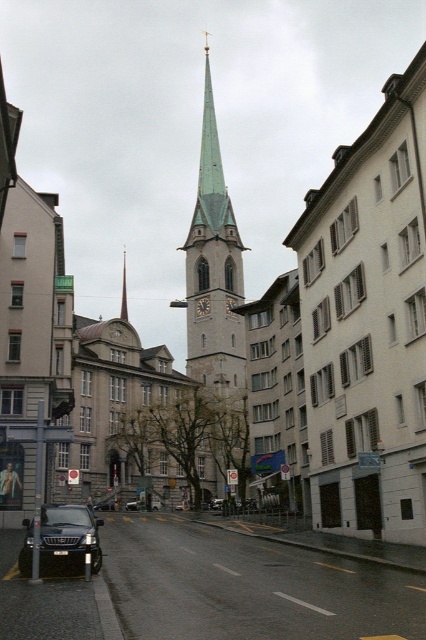
You are a pedestrian standing at the intersection and want to cross the street to reach the church tower in the background. You see a shiny black suv at lower left and a shiny black sedan at center. Which vehicle is closer to the church tower?

The shiny black suv at lower left is closer to the church tower because it is positioned to the right of the shiny black sedan at center, which is further away from the church tower.

You are a delivery driver who needs to park your vehicle in this street scene. You have two options for parking spots near the shiny black suv at lower left and the shiny black sedan at center. The parking spots are 64.34 meters apart. If your delivery requires you to be as close as possible to the church tower with a green spire, which parking spot should you choose?

The shiny black sedan at center is closer to the church tower with a green spire than the shiny black suv at lower left. Therefore, you should choose the parking spot near the shiny black sedan at center to be as close as possible to the church tower.

In the scene shown: You are standing on the street looking at the green stone clock tower at center. If you walk straight ahead, will you get closer to the tower?

Yes, walking straight ahead will bring you closer to the green stone clock tower at center since it is the focal point in front of you.